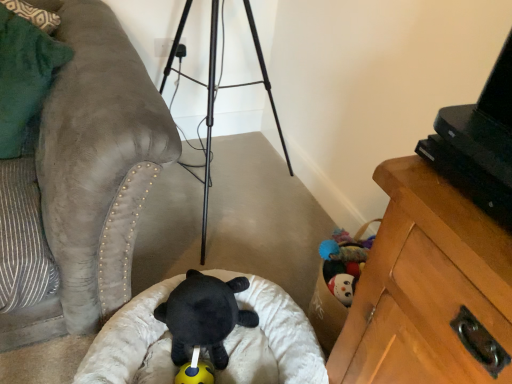
Question: Does black plastic tv at upper right have a lesser width compared to black plush bear at center, which appears as the 2th toy when ordered from the bottom?

Choices:
 (A) no
 (B) yes

Answer: (B)

Question: Would you consider black plastic tv at upper right to be distant from black plush bear at center, the 1th toy from the top?

Choices:
 (A) no
 (B) yes

Answer: (A)

Question: Is black plastic tv at upper right oriented away from black plush bear at center, the 1th toy from the top?

Choices:
 (A) yes
 (B) no

Answer: (B)

Question: From the image's perspective, does black plastic tv at upper right appear higher than black plush bear at center, the 1th toy from the top?

Choices:
 (A) yes
 (B) no

Answer: (A)

Question: From a real-world perspective, is black plastic tv at upper right on top of black plush bear at center, which appears as the 2th toy when ordered from the bottom?

Choices:
 (A) yes
 (B) no

Answer: (A)

Question: Considering the positions of yellow rubber ball at center, placed as the second toy when sorted from top to bottom, and green suede pillow at left in the image, is yellow rubber ball at center, placed as the second toy when sorted from top to bottom, wider or thinner than green suede pillow at left?

Choices:
 (A) wide
 (B) thin

Answer: (B)

Question: Considering the positions of yellow rubber ball at center, placed as the second toy when sorted from top to bottom, and green suede pillow at left in the image, is yellow rubber ball at center, placed as the second toy when sorted from top to bottom, taller or shorter than green suede pillow at left?

Choices:
 (A) tall
 (B) short

Answer: (B)

Question: Is yellow rubber ball at center, placed as the 1th toy when sorted from bottom to top, inside or outside of green suede pillow at left?

Choices:
 (A) outside
 (B) inside

Answer: (A)

Question: Is yellow rubber ball at center, placed as the second toy when sorted from top to bottom, bigger or smaller than green suede pillow at left?

Choices:
 (A) big
 (B) small

Answer: (B)

Question: Does point (210, 367) appear closer or farther from the camera than point (499, 162)?

Choices:
 (A) farther
 (B) closer

Answer: (A)

Question: Is yellow rubber ball at center, placed as the second toy when sorted from top to bottom, situated inside black plastic tv at upper right or outside?

Choices:
 (A) inside
 (B) outside

Answer: (B)

Question: In terms of width, does yellow rubber ball at center, placed as the second toy when sorted from top to bottom, look wider or thinner when compared to black plastic tv at upper right?

Choices:
 (A) wide
 (B) thin

Answer: (B)

Question: Looking at the image, does yellow rubber ball at center, placed as the second toy when sorted from top to bottom, seem bigger or smaller compared to black plastic tv at upper right?

Choices:
 (A) small
 (B) big

Answer: (A)

Question: From a real-world perspective, is black plush bear at center, the 1th toy from the top, above or below green suede pillow at left?

Choices:
 (A) above
 (B) below

Answer: (B)

Question: From the image's perspective, is black plush bear at center, the 1th toy from the top, positioned above or below green suede pillow at left?

Choices:
 (A) above
 (B) below

Answer: (B)